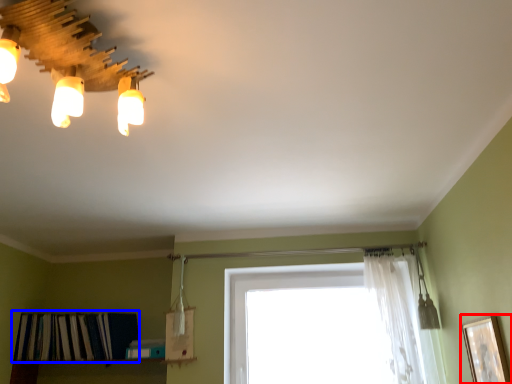
Question: Which point is closer to the camera, picture frame (highlighted by a red box) or shelf (highlighted by a blue box)?

Choices:
 (A) picture frame
 (B) shelf

Answer: (A)